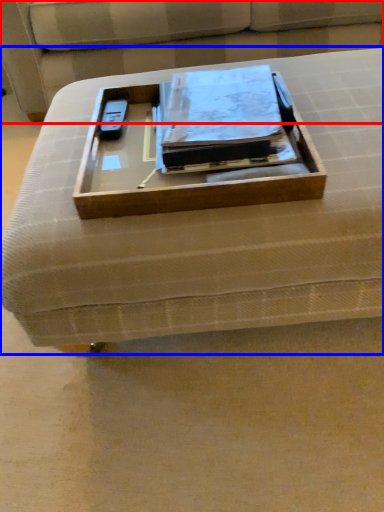
Question: Which of the following is the farthest to the observer, couch (highlighted by a red box) or furniture (highlighted by a blue box)?

Choices:
 (A) couch
 (B) furniture

Answer: (A)